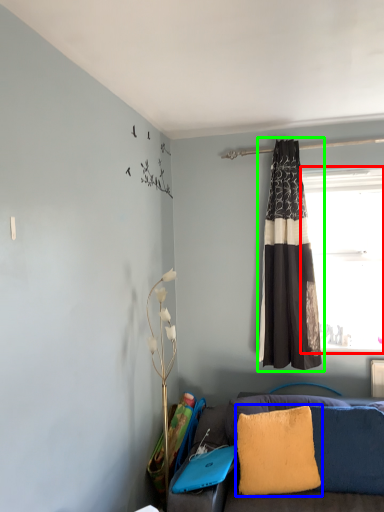
Question: Which object is the farthest from window (highlighted by a red box)? Choose among these: pillow (highlighted by a blue box) or curtain (highlighted by a green box).

Choices:
 (A) pillow
 (B) curtain

Answer: (A)